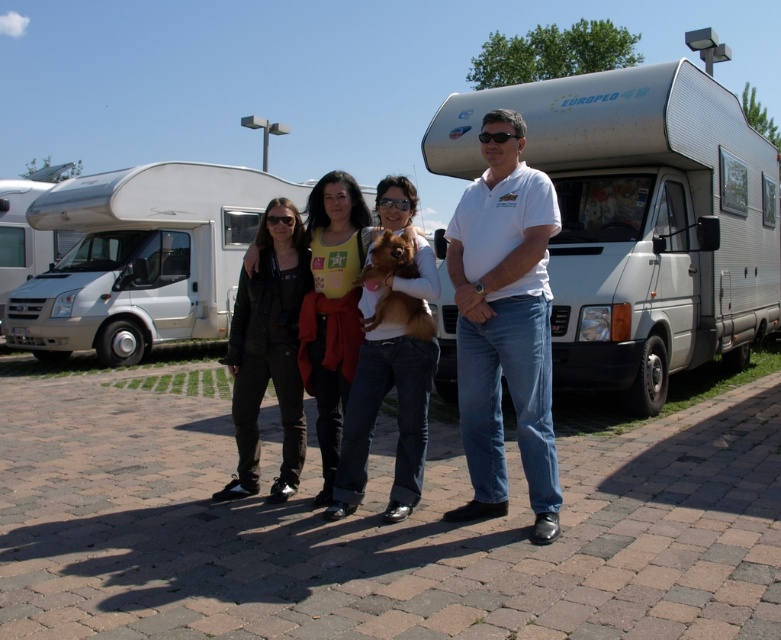
Question: Does white metallic camper van at left have a smaller size compared to matte white rv at upper right?

Choices:
 (A) no
 (B) yes

Answer: (B)

Question: Is white metallic recreational vehicle at center to the right of matte white rv at upper right from the viewer's perspective?

Choices:
 (A) no
 (B) yes

Answer: (B)

Question: Which of the following is the farthest from the observer?

Choices:
 (A) white metallic recreational vehicle at center
 (B) white cotton shirt at center
 (C) brown furry dog at center

Answer: (A)

Question: Estimate the real-world distances between objects in this image. Which object is closer to the white metallic camper van at left?

Choices:
 (A) matte white rv at upper right
 (B) yellow-green fabric shirt at center
 (C) dark brown leather jacket at center

Answer: (C)

Question: Does white metallic camper van at left appear under white glossy recreational vehicle at left?

Choices:
 (A) yes
 (B) no

Answer: (A)

Question: Estimate the real-world distances between objects in this image. Which object is closer to the white metallic recreational vehicle at center?

Choices:
 (A) yellow-green fabric shirt at center
 (B) white cotton shirt at center

Answer: (A)